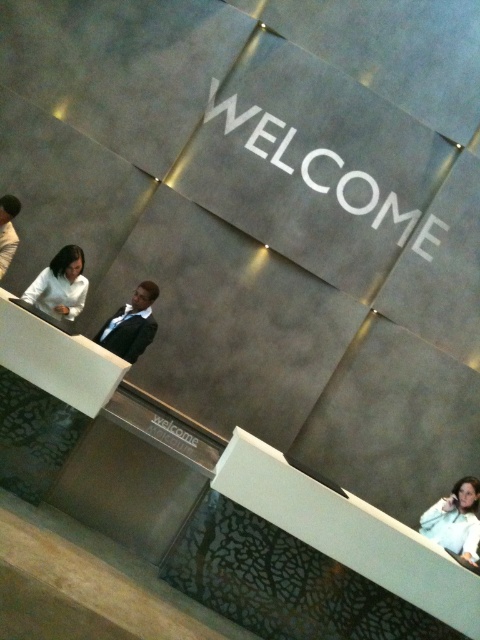
Question: Which of these objects is positioned closest to the white matte jacket at lower right?

Choices:
 (A) black suit at center
 (B) matte white blouse at left
 (C) black suit at left

Answer: (A)

Question: Estimate the real-world distances between objects in this image. Which object is closer to the black suit at left?

Choices:
 (A) matte white blouse at left
 (B) black suit at center
 (C) white matte jacket at lower right

Answer: (A)

Question: Considering the relative positions of black suit at center and black suit at left in the image provided, where is black suit at center located with respect to black suit at left?

Choices:
 (A) left
 (B) right

Answer: (B)

Question: Does white matte jacket at lower right come behind black suit at left?

Choices:
 (A) no
 (B) yes

Answer: (A)

Question: Which object appears farthest from the camera in this image?

Choices:
 (A) black suit at left
 (B) white matte jacket at lower right
 (C) matte white blouse at left

Answer: (A)

Question: Does white matte jacket at lower right appear over black suit at left?

Choices:
 (A) no
 (B) yes

Answer: (A)